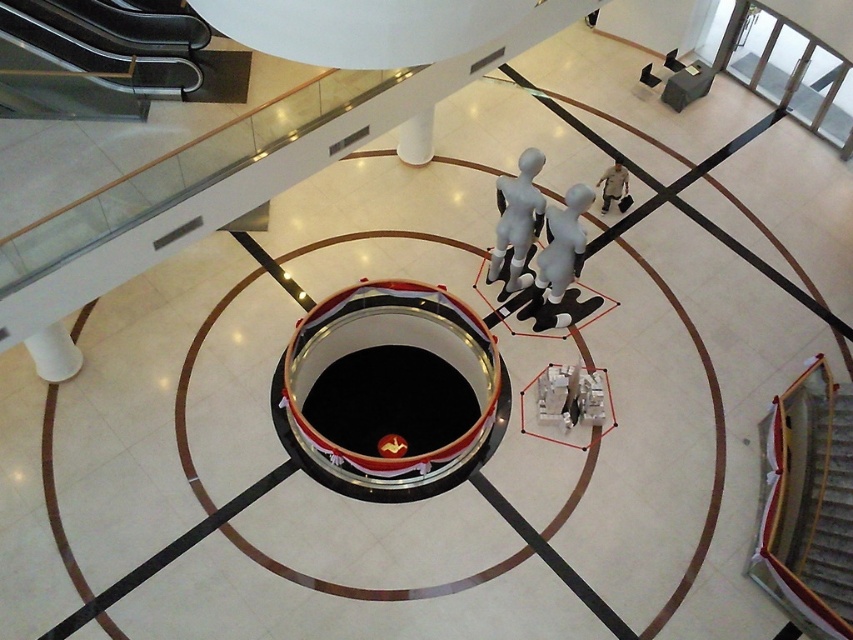
You are standing in the atrium and want to reach the central platform. There are two points marked on the floor, point (583,259) and point (601,176). Which point is closer to you?

Point (583,259) is closer to the viewer than point (601,176).

You are an interior designer planning to place a new sculpture in the atrium. The sculpture requires a space wider than the brown fabric shirt at upper right. Can the smooth matte mannequin at center accommodate the sculpture?

The smooth matte mannequin at center has a larger width than the brown fabric shirt at upper right, so it can accommodate the sculpture.